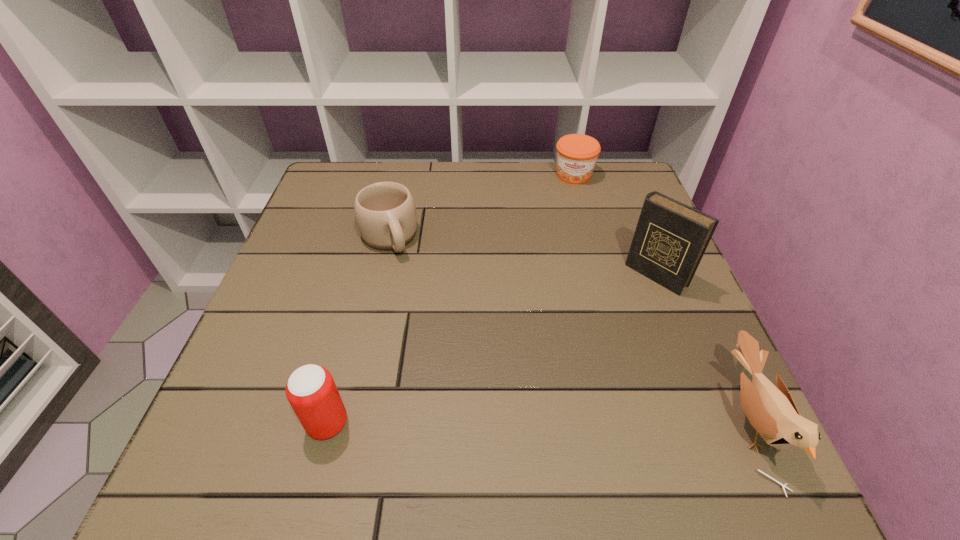
You are a GUI agent. You are given a task and a screenshot of the screen. Output one action in this format:
    pyautogui.click(x=<x>, y=<y>)
    Task: Click on the blank space located 0.380m on the front cover of the tallest object
    This screenshot has width=960, height=540.
    Given the screenshot: What is the action you would take?
    click(x=522, y=402)

The width and height of the screenshot is (960, 540). In order to click on free location located 0.060m on the front cover of the tallest object in this screenshot , I will do `click(626, 304)`.

You are a GUI agent. You are given a task and a screenshot of the screen. Output one action in this format:
    pyautogui.click(x=<x>, y=<y>)
    Task: Click on the vacant space located on the front cover of the tallest object
    
    Given the screenshot: What is the action you would take?
    pyautogui.click(x=563, y=364)

Find the location of a particular element. Image resolution: width=960 pixels, height=540 pixels. vacant space located 0.280m on the side of the mug with the handle is located at coordinates (440, 352).

Where is `free region located on the side of the mug with the handle`? free region located on the side of the mug with the handle is located at coordinates (456, 386).

In order to click on free location located 0.220m on the side of the mug with the handle in this screenshot , I will do `click(429, 329)`.

The height and width of the screenshot is (540, 960). What are the coordinates of `vacant area located 0.180m on the front label of the jam` in the screenshot? It's located at (569, 226).

The image size is (960, 540). I want to click on free space located 0.100m on the front label of the jam, so click(571, 207).

The height and width of the screenshot is (540, 960). In order to click on vacant area located 0.150m on the front label of the jam in this screenshot , I will do `click(570, 219)`.

What are the coordinates of `object positioned at the far edge` in the screenshot? It's located at (577, 154).